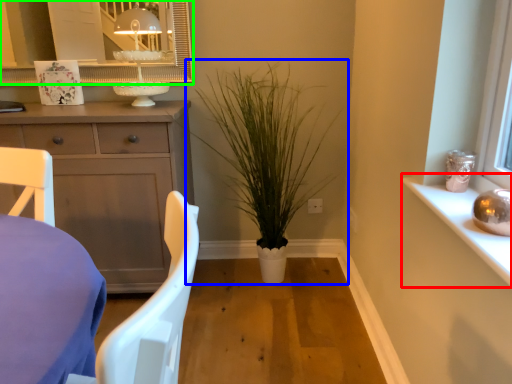
Question: Which object is the farthest from window sill (highlighted by a red box)? Choose among these: houseplant (highlighted by a blue box) or mirror (highlighted by a green box).

Choices:
 (A) houseplant
 (B) mirror

Answer: (B)